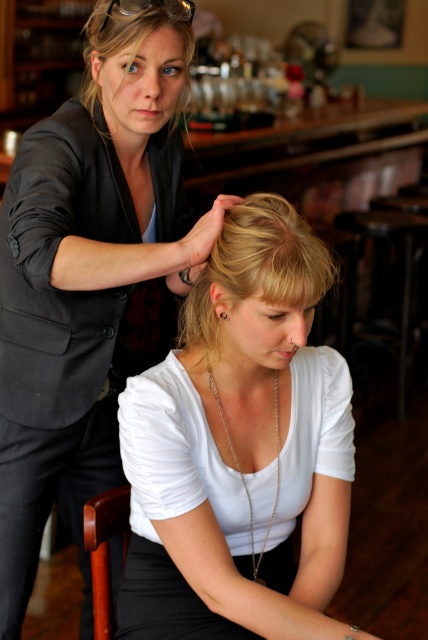
Question: Which of these objects is positioned farthest from the matte black suit at upper left?

Choices:
 (A) blonde hair at center
 (B) blonde hair at upper left

Answer: (B)

Question: Is matte black suit at upper left wider than blonde hair at center?

Choices:
 (A) yes
 (B) no

Answer: (A)

Question: Observing the image, what is the correct spatial positioning of matte black suit at upper left in reference to blonde hair at center?

Choices:
 (A) below
 (B) above

Answer: (A)

Question: Which point is closer to the camera taking this photo?

Choices:
 (A) (261, 284)
 (B) (140, 24)
 (C) (252, 532)
 (D) (166, 248)

Answer: (A)

Question: Considering the real-world distances, which object is closest to the matte black suit at upper left?

Choices:
 (A) silver chain necklace at center
 (B) white matte hair at center

Answer: (B)

Question: Is matte black suit at upper left closer to the viewer compared to silver chain necklace at center?

Choices:
 (A) no
 (B) yes

Answer: (A)